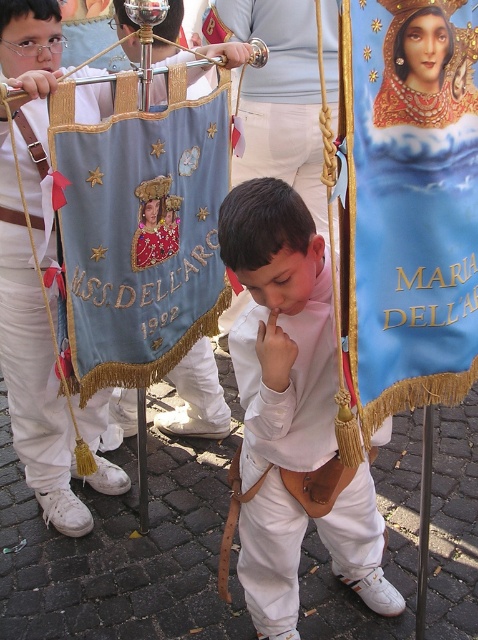
Does white leather belt at center appear on the left side of light blue fabric banner at left?

Incorrect, white leather belt at center is not on the left side of light blue fabric banner at left.

You are a GUI agent. You are given a task and a screenshot of the screen. Output one action in this format:
    pyautogui.click(x=<x>, y=<y>)
    Task: Click on the white leather belt at center
    
    Given the screenshot: What is the action you would take?
    pyautogui.click(x=292, y=412)

Who is more forward, (257, 220) or (45, 406)?

Point (257, 220) is in front.

This screenshot has height=640, width=478. What are the coordinates of `white leather belt at center` in the screenshot? It's located at (292, 412).

Is blue fabric banner at center to the right of light blue fabric banner at left from the viewer's perspective?

Yes, blue fabric banner at center is to the right of light blue fabric banner at left.

Based on the photo, between blue fabric banner at center and light blue fabric banner at left, which one appears on the left side from the viewer's perspective?

light blue fabric banner at left

The width and height of the screenshot is (478, 640). What are the coordinates of `blue fabric banner at center` in the screenshot? It's located at (408, 202).

Is point (403, 100) less distant than point (269, 605)?

Yes, it is.

Is blue fabric banner at center above white leather belt at center?

Yes.

Is point (368, 401) closer to viewer compared to point (368, 465)?

Yes.

Identify the location of blue fabric banner at center. (408, 202).